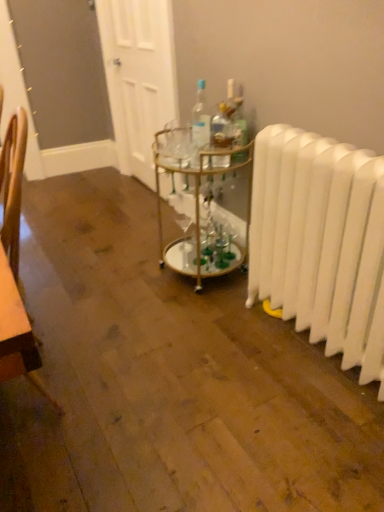
This screenshot has height=512, width=384. Find the location of `clear glass bottle at center, which appears as the second bottle when viewed from the right`. clear glass bottle at center, which appears as the second bottle when viewed from the right is located at coordinates (221, 126).

Image resolution: width=384 pixels, height=512 pixels. What do you see at coordinates (321, 242) in the screenshot? I see `white plastic radiator at right` at bounding box center [321, 242].

You are a GUI agent. You are given a task and a screenshot of the screen. Output one action in this format:
    pyautogui.click(x=<x>, y=<y>)
    Task: Click on the gold metallic bar cart at center
    Image resolution: width=384 pixels, height=512 pixels.
    Given the screenshot: What is the action you would take?
    pyautogui.click(x=202, y=207)

In order to face gold metallic bar cart at center, should I rotate leftwards or rightwards?

It's best to rotate right around 1.750 degrees.

Image resolution: width=384 pixels, height=512 pixels. Identify the location of translucent glass bottle at center, the 1th bottle positioned from the right. (239, 123).

The width and height of the screenshot is (384, 512). Describe the element at coordinates (200, 123) in the screenshot. I see `clear glass bottle at center, which is counted as the 1th bottle, starting from the left` at that location.

Locate an element on the screen. clear glass bottle at center, acting as the 2th bottle starting from the left is located at coordinates (221, 126).

From the image's perspective, is clear glass bottle at center, which ranks as the third bottle in right-to-left order, below clear glass bottle at center, which appears as the second bottle when viewed from the right?

Actually, clear glass bottle at center, which ranks as the third bottle in right-to-left order, appears above clear glass bottle at center, which appears as the second bottle when viewed from the right, in the image.

Which point is more forward, (195, 128) or (227, 119)?

The point (227, 119) is more forward.

In the scene shown: Does clear glass bottle at center, which is counted as the 1th bottle, starting from the left, have a lesser width compared to clear glass bottle at center, acting as the 2th bottle starting from the left?

No, clear glass bottle at center, which is counted as the 1th bottle, starting from the left, is not thinner than clear glass bottle at center, acting as the 2th bottle starting from the left.

Does clear glass bottle at center, which ranks as the third bottle in right-to-left order, have a larger size compared to clear glass bottle at center, which appears as the second bottle when viewed from the right?

Correct, clear glass bottle at center, which ranks as the third bottle in right-to-left order, is larger in size than clear glass bottle at center, which appears as the second bottle when viewed from the right.

Is translucent glass bottle at center, the 3th bottle when ordered from left to right, beside gold metallic bar cart at center?

No, translucent glass bottle at center, the 3th bottle when ordered from left to right, is not beside gold metallic bar cart at center.

Who is shorter, translucent glass bottle at center, the 3th bottle when ordered from left to right, or gold metallic bar cart at center?

Standing shorter between the two is translucent glass bottle at center, the 3th bottle when ordered from left to right.

Is the position of translucent glass bottle at center, the 1th bottle positioned from the right, less distant than that of gold metallic bar cart at center?

No, it is behind gold metallic bar cart at center.

Does white plastic radiator at right have a lesser width compared to clear glass bottle at center, which appears as the second bottle when viewed from the right?

In fact, white plastic radiator at right might be wider than clear glass bottle at center, which appears as the second bottle when viewed from the right.

Considering the positions of objects white plastic radiator at right and clear glass bottle at center, acting as the 2th bottle starting from the left, in the image provided, who is more to the right, white plastic radiator at right or clear glass bottle at center, acting as the 2th bottle starting from the left,?

From the viewer's perspective, white plastic radiator at right appears more on the right side.

From the image's perspective, is white plastic radiator at right beneath clear glass bottle at center, which appears as the second bottle when viewed from the right?

Correct, white plastic radiator at right appears lower than clear glass bottle at center, which appears as the second bottle when viewed from the right, in the image.

How distant is gold metallic bar cart at center from white plastic radiator at right?

gold metallic bar cart at center is 15.53 inches away from white plastic radiator at right.

Is gold metallic bar cart at center touching white plastic radiator at right?

No, gold metallic bar cart at center is not making contact with white plastic radiator at right.

Is gold metallic bar cart at center bigger than white plastic radiator at right?

Yes, gold metallic bar cart at center is bigger than white plastic radiator at right.

From the image's perspective, does clear glass bottle at center, which appears as the second bottle when viewed from the right, appear higher than clear glass bottle at center, which ranks as the third bottle in right-to-left order?

No, from the image's perspective, clear glass bottle at center, which appears as the second bottle when viewed from the right, is not above clear glass bottle at center, which ranks as the third bottle in right-to-left order.

Is clear glass bottle at center, acting as the 2th bottle starting from the left, turned away from clear glass bottle at center, which ranks as the third bottle in right-to-left order?

No.

Can you tell me how much clear glass bottle at center, acting as the 2th bottle starting from the left, and clear glass bottle at center, which ranks as the third bottle in right-to-left order, differ in facing direction?

→ 0.000227 degrees separate the facing orientations of clear glass bottle at center, acting as the 2th bottle starting from the left, and clear glass bottle at center, which ranks as the third bottle in right-to-left order.

Considering the relative sizes of clear glass bottle at center, which appears as the second bottle when viewed from the right, and clear glass bottle at center, which ranks as the third bottle in right-to-left order, in the image provided, is clear glass bottle at center, which appears as the second bottle when viewed from the right, shorter than clear glass bottle at center, which ranks as the third bottle in right-to-left order,?

Indeed, clear glass bottle at center, which appears as the second bottle when viewed from the right, has a lesser height compared to clear glass bottle at center, which ranks as the third bottle in right-to-left order.

From a real-world perspective, between gold metallic bar cart at center and translucent glass bottle at center, the 3th bottle when ordered from left to right, who is vertically lower?

In real-world perspective, gold metallic bar cart at center is lower.

Is gold metallic bar cart at center outside of translucent glass bottle at center, the 3th bottle when ordered from left to right?

Yes, gold metallic bar cart at center is not within translucent glass bottle at center, the 3th bottle when ordered from left to right.

Considering the positions of objects gold metallic bar cart at center and translucent glass bottle at center, the 1th bottle positioned from the right, in the image provided, who is behind, gold metallic bar cart at center or translucent glass bottle at center, the 1th bottle positioned from the right,?

translucent glass bottle at center, the 1th bottle positioned from the right, is behind.

Based on the photo, how distant is clear glass bottle at center, which ranks as the third bottle in right-to-left order, from gold metallic bar cart at center?

12.13 inches.

Considering the sizes of clear glass bottle at center, which is counted as the 1th bottle, starting from the left, and gold metallic bar cart at center in the image, is clear glass bottle at center, which is counted as the 1th bottle, starting from the left, taller or shorter than gold metallic bar cart at center?

Clearly, clear glass bottle at center, which is counted as the 1th bottle, starting from the left, is shorter compared to gold metallic bar cart at center.

Would you say clear glass bottle at center, which is counted as the 1th bottle, starting from the left, is inside or outside gold metallic bar cart at center?

The correct answer is: outside.

Which of these two, clear glass bottle at center, which is counted as the 1th bottle, starting from the left, or gold metallic bar cart at center, is wider?

With larger width is gold metallic bar cart at center.

You are a GUI agent. You are given a task and a screenshot of the screen. Output one action in this format:
    pyautogui.click(x=<x>, y=<y>)
    Task: Click on the bottle that is the 2nd one when counting forward from the clear glass bottle at center, which ranks as the third bottle in right-to-left order
    
    Given the screenshot: What is the action you would take?
    pyautogui.click(x=221, y=126)

This screenshot has width=384, height=512. What are the coordinates of `table below the translucent glass bottle at center, the 1th bottle positioned from the right (from a real-world perspective)` in the screenshot? It's located at (202, 207).

In the scene shown: When comparing their distances from translucent glass bottle at center, the 1th bottle positioned from the right, does clear glass bottle at center, which ranks as the third bottle in right-to-left order, or gold metallic bar cart at center seem closer?

Based on the image, clear glass bottle at center, which ranks as the third bottle in right-to-left order, appears to be nearer to translucent glass bottle at center, the 1th bottle positioned from the right.

Estimate the real-world distances between objects in this image. Which object is further from translucent glass bottle at center, the 1th bottle positioned from the right, gold metallic bar cart at center or white wooden door at upper center?

The object further to translucent glass bottle at center, the 1th bottle positioned from the right, is white wooden door at upper center.

When comparing their distances from clear glass bottle at center, which is counted as the 1th bottle, starting from the left, does white wooden door at upper center or white plastic radiator at right seem further?

white wooden door at upper center lies further to clear glass bottle at center, which is counted as the 1th bottle, starting from the left, than the other object.

Based on their spatial positions, is translucent glass bottle at center, the 3th bottle when ordered from left to right, or clear glass bottle at center, which ranks as the third bottle in right-to-left order, further from clear glass bottle at center, acting as the 2th bottle starting from the left?

clear glass bottle at center, which ranks as the third bottle in right-to-left order, is further to clear glass bottle at center, acting as the 2th bottle starting from the left.

Looking at the image, which one is located further to translucent glass bottle at center, the 1th bottle positioned from the right, clear glass bottle at center, which ranks as the third bottle in right-to-left order, or white plastic radiator at right?

white plastic radiator at right is positioned further to the anchor translucent glass bottle at center, the 1th bottle positioned from the right.

Looking at the image, which one is located closer to clear glass bottle at center, which ranks as the third bottle in right-to-left order, translucent glass bottle at center, the 1th bottle positioned from the right, or clear glass bottle at center, which appears as the second bottle when viewed from the right?

clear glass bottle at center, which appears as the second bottle when viewed from the right, is positioned closer to the anchor clear glass bottle at center, which ranks as the third bottle in right-to-left order.

Looking at the image, which one is located closer to white wooden door at upper center, white plastic radiator at right or clear glass bottle at center, acting as the 2th bottle starting from the left?

Among the two, clear glass bottle at center, acting as the 2th bottle starting from the left, is located nearer to white wooden door at upper center.

Estimate the real-world distances between objects in this image. Which object is closer to gold metallic bar cart at center, white plastic radiator at right or clear glass bottle at center, which ranks as the third bottle in right-to-left order?

clear glass bottle at center, which ranks as the third bottle in right-to-left order, is closer to gold metallic bar cart at center.

I want to click on table between white plastic radiator at right and clear glass bottle at center, which is counted as the 1th bottle, starting from the left, from front to back, so click(202, 207).

The image size is (384, 512). What are the coordinates of `table positioned between white plastic radiator at right and white wooden door at upper center from near to far` in the screenshot? It's located at (202, 207).

Locate an element on the screen. The width and height of the screenshot is (384, 512). bottle between translucent glass bottle at center, the 3th bottle when ordered from left to right, and gold metallic bar cart at center from top to bottom is located at coordinates (221, 126).

Locate an element on the screen. bottle between clear glass bottle at center, which is counted as the 1th bottle, starting from the left, and translucent glass bottle at center, the 3th bottle when ordered from left to right is located at coordinates (221, 126).